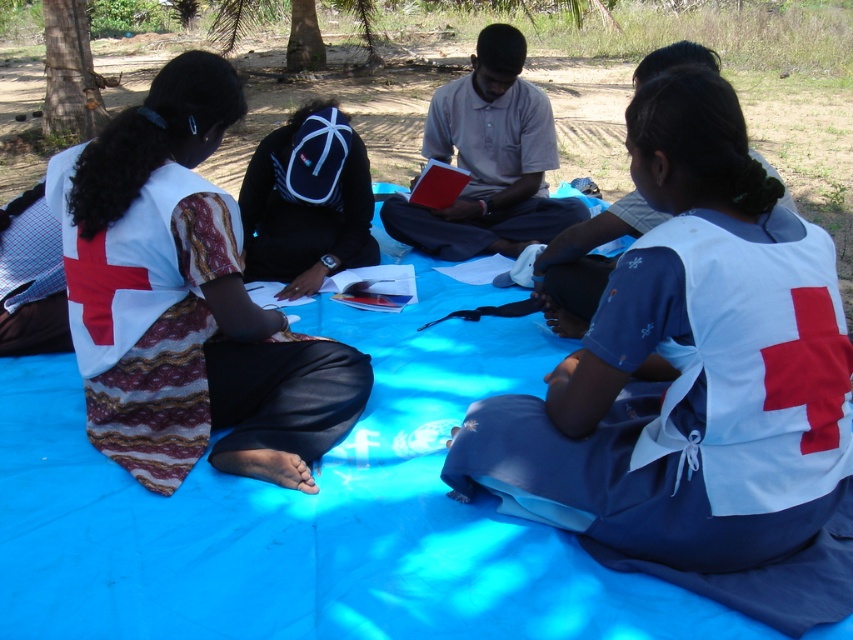
Question: Which point appears closest to the camera in this image?

Choices:
 (A) (90, 68)
 (B) (660, 72)

Answer: (B)

Question: Which of these objects is positioned farthest from the white fabric shirt at left?

Choices:
 (A) white fabric shirt at upper right
 (B) smooth brown tree trunk at upper left
 (C) light gray cotton shirt at center
 (D) white fabric vest at center

Answer: (B)

Question: Can you confirm if white fabric shirt at upper right is wider than smooth brown tree trunk at upper left?

Choices:
 (A) no
 (B) yes

Answer: (A)

Question: Does white fabric vest at center appear under white fabric shirt at left?

Choices:
 (A) yes
 (B) no

Answer: (A)

Question: Among these points, which one is nearest to the camera?

Choices:
 (A) pyautogui.click(x=206, y=88)
 (B) pyautogui.click(x=48, y=22)

Answer: (A)

Question: Can you confirm if light gray cotton shirt at center is positioned to the right of navy blue backpack at center?

Choices:
 (A) yes
 (B) no

Answer: (A)